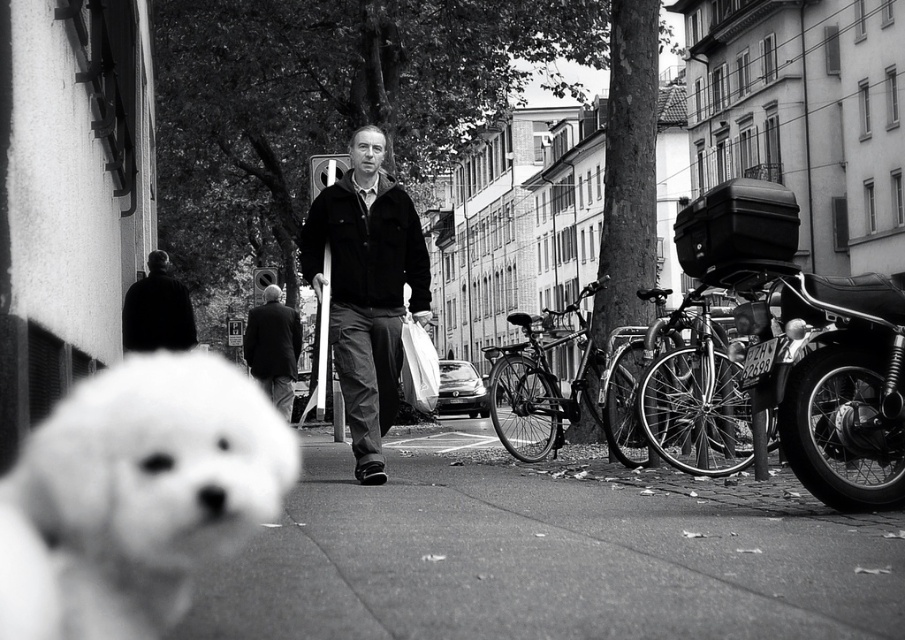
Does point (569, 476) lie behind point (262, 333)?

No, (569, 476) is closer to viewer.

Image resolution: width=905 pixels, height=640 pixels. Describe the element at coordinates (548, 557) in the screenshot. I see `smooth asphalt at center` at that location.

You are a GUI agent. You are given a task and a screenshot of the screen. Output one action in this format:
    pyautogui.click(x=<x>, y=<y>)
    Task: Click on the smooth asphalt at center
    This screenshot has height=640, width=905.
    Given the screenshot: What is the action you would take?
    pyautogui.click(x=548, y=557)

Is shiny black motorcycle at right bigger than black matte jacket at center?

Correct, shiny black motorcycle at right is larger in size than black matte jacket at center.

Between shiny black motorcycle at right and black matte jacket at center, which one has less height?

With less height is shiny black motorcycle at right.

Between point (872, 486) and point (389, 364), which one is positioned in front?

Point (872, 486) is more forward.

Find the location of a particular element. shiny black motorcycle at right is located at coordinates 807,342.

Does fluffy white dog at lower left come in front of black matte jacket at upper left?

Yes, it is.

Based on the photo, can you confirm if fluffy white dog at lower left is positioned to the right of black matte jacket at upper left?

Indeed, fluffy white dog at lower left is positioned on the right side of black matte jacket at upper left.

Measure the distance between point (169, 400) and camera.

Point (169, 400) and camera are 35.88 feet apart from each other.

Where is `fluffy white dog at lower left`? The width and height of the screenshot is (905, 640). fluffy white dog at lower left is located at coordinates (138, 496).